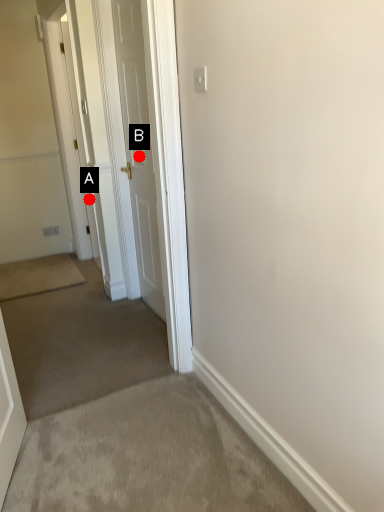
Question: Two points are circled on the image, labeled by A and B beside each circle. Among these points, which one is nearest to the camera?

Choices:
 (A) A is closer
 (B) B is closer

Answer: (B)